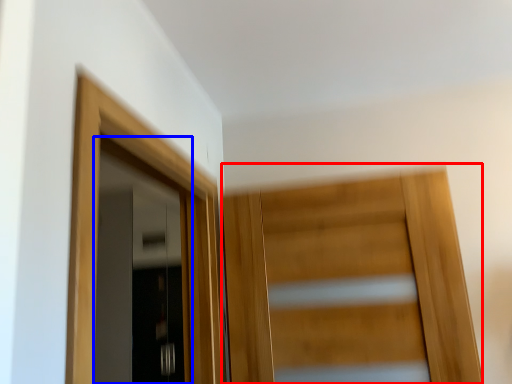
Question: Which object appears farthest to the camera in this image, door (highlighted by a red box) or door (highlighted by a blue box)?

Choices:
 (A) door
 (B) door

Answer: (B)